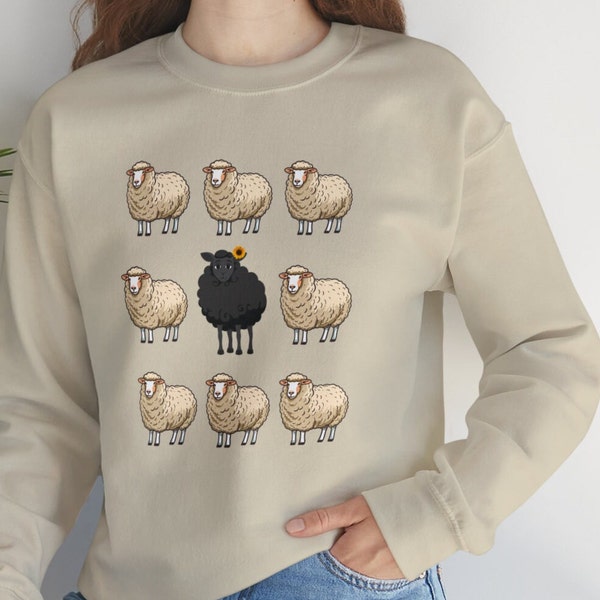
You are a GUI agent. You are given a task and a screenshot of the screen. Output one action in this format:
    pyautogui.click(x=<x>, y=<y>)
    Task: Click on the wall
    The width and height of the screenshot is (600, 600).
    Given the screenshot: What is the action you would take?
    pyautogui.click(x=494, y=68)